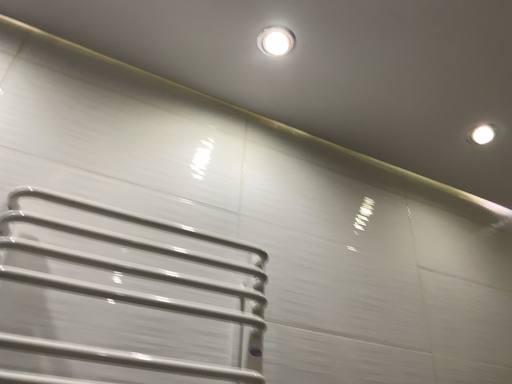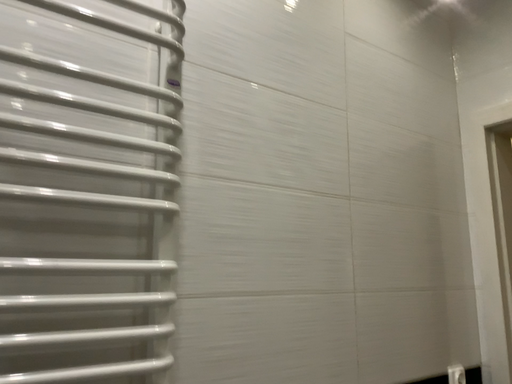
Question: How did the camera likely rotate when shooting the video?

Choices:
 (A) rotated upward
 (B) rotated downward

Answer: (B)